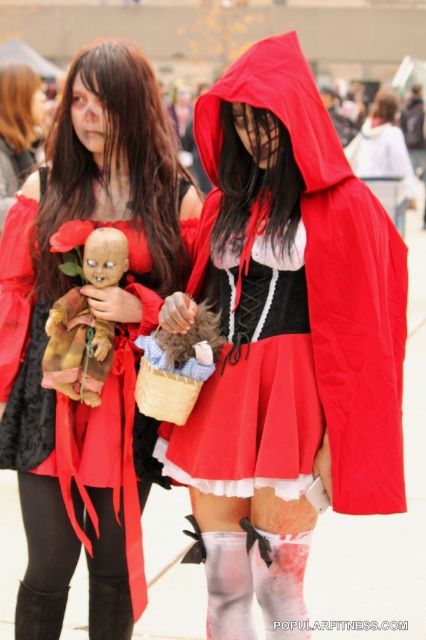
What do you see at coordinates (100, 317) in the screenshot?
I see `matte black dress at center` at bounding box center [100, 317].

Which of these two, matte black dress at center or distressed brown doll at center, stands shorter?

distressed brown doll at center

Between point (146, 221) and point (109, 248), which one is positioned in front?

Point (109, 248) is more forward.

This screenshot has height=640, width=426. Identify the location of matte black dress at center. coord(100,317).

Does point (230, 108) come closer to viewer compared to point (402, 172)?

Yes.

In the scene shown: Who is positioned more to the right, matte red cape at center or matte red coat at center?

matte red coat at center

Describe the element at coordinates (287, 339) in the screenshot. Image resolution: width=426 pixels, height=640 pixels. I see `matte red cape at center` at that location.

At what (x,y) coordinates should I click in order to perform the action: click on matte red cape at center. Please return your answer as a coordinate pair (x, y). This screenshot has width=426, height=640. Looking at the image, I should click on (287, 339).

Can you confirm if matte red cape at center is positioned below distressed brown doll at center?

Indeed, matte red cape at center is positioned under distressed brown doll at center.

Is point (294, 225) farther from viewer compared to point (106, 250)?

No.

At what (x,y) coordinates should I click in order to perform the action: click on matte red cape at center. Please return your answer as a coordinate pair (x, y). This screenshot has height=640, width=426. Looking at the image, I should click on (287, 339).

Where is `matte red cape at center`? matte red cape at center is located at coordinates (287, 339).